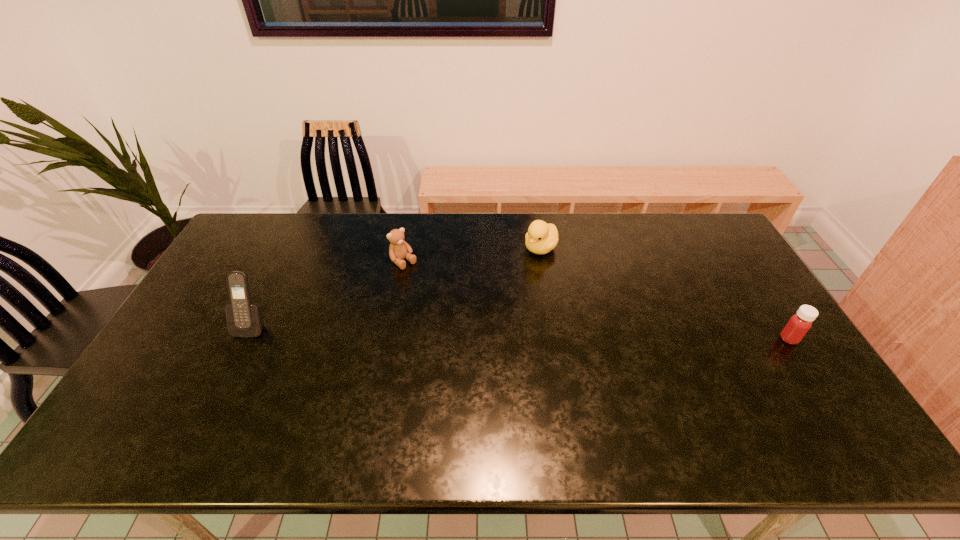
You are a GUI agent. You are given a task and a screenshot of the screen. Output one action in this format:
    pyautogui.click(x=<x>, y=<y>)
    Task: Click on the vacant region located 0.360m on the face of the teddy bear
    
    Given the screenshot: What is the action you would take?
    pyautogui.click(x=481, y=334)

The image size is (960, 540). What are the coordinates of `free point located on the face of the teddy bear` in the screenshot? It's located at (425, 282).

What are the coordinates of `free space located 0.350m on the face of the teddy bear` in the screenshot? It's located at (479, 332).

Where is `duck that is at the far edge`? duck that is at the far edge is located at coordinates (541, 238).

Locate an element on the screen. The height and width of the screenshot is (540, 960). teddy bear that is at the far edge is located at coordinates (398, 250).

The height and width of the screenshot is (540, 960). I want to click on object at the right edge, so click(x=799, y=324).

Locate an element on the screen. This screenshot has height=540, width=960. vacant area at the far edge is located at coordinates (623, 216).

Image resolution: width=960 pixels, height=540 pixels. In the image, there is a desktop. Find the location of `vacant space at the near edge`. vacant space at the near edge is located at coordinates (309, 395).

Locate an element on the screen. The width and height of the screenshot is (960, 540). vacant region at the left edge of the desktop is located at coordinates pos(233,263).

Image resolution: width=960 pixels, height=540 pixels. What are the coordinates of `free region at the right edge of the desktop` in the screenshot? It's located at (756, 334).